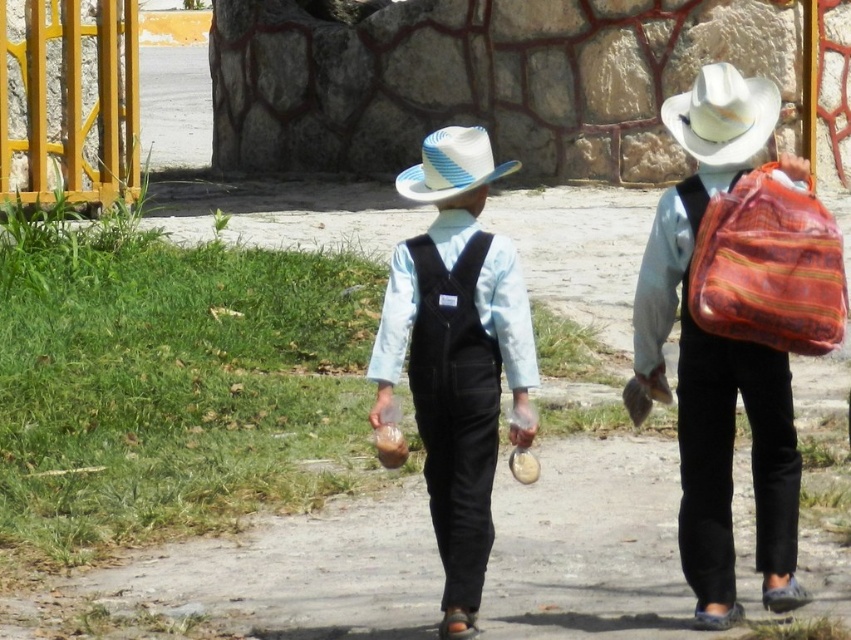
You are a photographer trying to capture a photo of the two people walking away. You notice the matte orange fabric bag at right and the white woven hat at upper right in your frame. Which object should you focus on if you want to capture the taller one in your shot?

The matte orange fabric bag at right is taller than the white woven hat at upper right, so you should focus on the matte orange fabric bag at right to capture the taller object in your photo.

You are a photographer trying to capture both the matte straw hat at center and the blue and white striped straw hat at center in a single shot. Which hat should you focus on first to ensure both are in frame?

You should focus on the blue and white striped straw hat at center first because the matte straw hat at center is positioned below it, so adjusting the camera to include the higher one will naturally include the lower one as well.